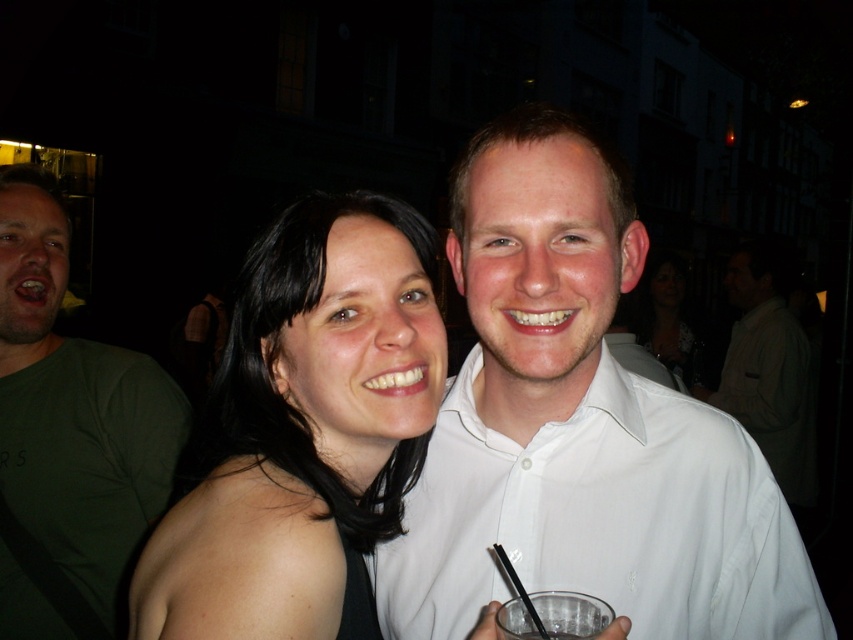
Is white smooth shirt at upper center below clear glass at lower right?

No.

How much distance is there between white smooth shirt at upper center and clear glass at lower right?

They are 26.50 centimeters apart.

Between point (659, 564) and point (500, 620), which one is positioned behind?

The point (659, 564) is more distant.

This screenshot has width=853, height=640. Find the location of `white smooth shirt at upper center`. white smooth shirt at upper center is located at coordinates (601, 518).

Who is positioned more to the left, green cotton t-shirt at left or clear glass at lower right?

From the viewer's perspective, green cotton t-shirt at left appears more on the left side.

This screenshot has width=853, height=640. Find the location of `green cotton t-shirt at left`. green cotton t-shirt at left is located at coordinates (70, 428).

Which is more to the right, black matte hair at center or white smooth shirt at upper center?

white smooth shirt at upper center

Which is more to the left, black matte hair at center or white smooth shirt at upper center?

From the viewer's perspective, black matte hair at center appears more on the left side.

Is point (258, 637) in front of point (703, 465)?

Yes, point (258, 637) is in front of point (703, 465).

Locate an element on the screen. black matte hair at center is located at coordinates (303, 432).